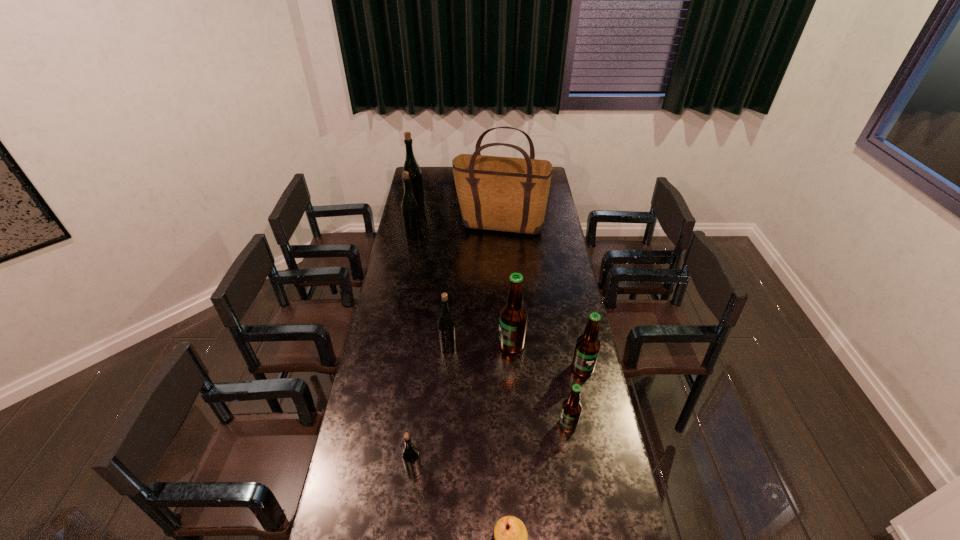
The image size is (960, 540). In order to click on vacant area that lies between the tote bag and the farthest beer bottle in this screenshot , I will do `click(458, 217)`.

At what (x,y) coordinates should I click in order to perform the action: click on vacant area that lies between the leftmost brown beer bottle and the nearest brown beer bottle. Please return your answer as a coordinate pair (x, y). Looking at the image, I should click on (540, 384).

At what (x,y) coordinates should I click in order to perform the action: click on free point between the tote bag and the second smallest green beer bottle. Please return your answer as a coordinate pair (x, y). This screenshot has width=960, height=540. Looking at the image, I should click on (474, 287).

This screenshot has width=960, height=540. In order to click on free spot between the second biggest green beer bottle and the farthest brown beer bottle in this screenshot , I will do `click(463, 289)`.

Image resolution: width=960 pixels, height=540 pixels. I want to click on vacant area between the tote bag and the second farthest green beer bottle, so click(456, 231).

The width and height of the screenshot is (960, 540). I want to click on vacant area that lies between the biggest brown beer bottle and the second farthest green beer bottle, so click(x=463, y=289).

Identify the location of vacant area that lies between the second nearest green beer bottle and the sixth nearest beer bottle. The height and width of the screenshot is (540, 960). (431, 291).

Point out which object is positioned as the fifth nearest to the farthest beer bottle. Please provide its 2D coordinates. Your answer should be formatted as a tuple, i.e. [(x, y)], where the tuple contains the x and y coordinates of a point satisfying the conditions above.

[(588, 345)]

Locate which object ranks seventh in proximity to the second nearest green beer bottle. Please provide its 2D coordinates. Your answer should be formatted as a tuple, i.e. [(x, y)], where the tuple contains the x and y coordinates of a point satisfying the conditions above.

[(409, 207)]

At what (x,y) coordinates should I click in order to perform the action: click on beer bottle that is the fourth closest to the second farthest green beer bottle. Please return your answer as a coordinate pair (x, y). The image size is (960, 540). Looking at the image, I should click on (588, 345).